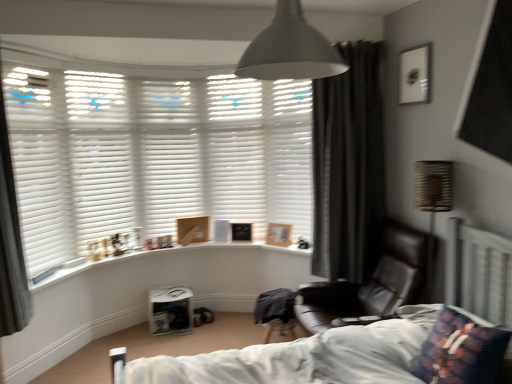
In order to face dark grey curtain at right, the second curtain in the left-to-right sequence, should I rotate leftwards or rightwards?

Turn right by 12.532 degrees to look at dark grey curtain at right, the second curtain in the left-to-right sequence.

The width and height of the screenshot is (512, 384). What do you see at coordinates (462, 350) in the screenshot?
I see `dark floral fabric pillow at lower right` at bounding box center [462, 350].

At what (x,y) coordinates should I click in order to perform the action: click on white matte shutter at upper center, which appears as the 1th shutter when viewed from the right. Please return your answer as a coordinate pair (x, y). Looking at the image, I should click on (288, 153).

Looking at this image, how much space does white matte shutter at upper center, which appears as the 2th shutter when viewed from the right, occupy horizontally?

The width of white matte shutter at upper center, which appears as the 2th shutter when viewed from the right, is 10.87 inches.

What do you see at coordinates (192, 230) in the screenshot?
I see `wooden picture frame at upper center, which is counted as the 2th picture frame, starting from the back` at bounding box center [192, 230].

This screenshot has width=512, height=384. I want to click on white wood window sill at center, so click(154, 253).

Does wooden picture frame at window, arranged as the 3th picture frame when viewed from the back, turn towards wooden picture frame at window sill, which is the 2th picture frame in left-to-right order?

No, wooden picture frame at window, arranged as the 3th picture frame when viewed from the back, is not turned towards wooden picture frame at window sill, which is the 2th picture frame in left-to-right order.

Is point (276, 229) in front of point (233, 229)?

Yes, it is.

Does wooden picture frame at window, the 2th picture frame in the front-to-back sequence, appear on the left side of wooden picture frame at window sill, marked as the 4th picture frame in a front-to-back arrangement?

No.

Considering the relative sizes of wooden picture frame at window, the 2th picture frame in the front-to-back sequence, and wooden picture frame at window sill, which is the 1th picture frame from back to front, in the image provided, is wooden picture frame at window, the 2th picture frame in the front-to-back sequence, smaller than wooden picture frame at window sill, which is the 1th picture frame from back to front,?

Incorrect, wooden picture frame at window, the 2th picture frame in the front-to-back sequence, is not smaller in size than wooden picture frame at window sill, which is the 1th picture frame from back to front.

Can you confirm if wooden picture frame at upper center, marked as the fourth picture frame in a right-to-left arrangement, is bigger than dark floral fabric pillow at lower right?

Incorrect, wooden picture frame at upper center, marked as the fourth picture frame in a right-to-left arrangement, is not larger than dark floral fabric pillow at lower right.

From the image's perspective, is wooden picture frame at upper center, the 3th picture frame in the bottom-to-top sequence, above dark floral fabric pillow at lower right?

Yes.

From the picture: Is wooden picture frame at upper center, which is the 2th picture frame from top to bottom, looking in the opposite direction of dark floral fabric pillow at lower right?

No.

From a real-world perspective, relative to dark floral fabric pillow at lower right, is wooden picture frame at upper center, the first picture frame positioned from the left, vertically above or below?

Clearly, from a real-world perspective, wooden picture frame at upper center, the first picture frame positioned from the left, is above dark floral fabric pillow at lower right.

Is matte black picture frame at upper right, which appears as the fourth picture frame when viewed from the back, positioned far away from wooden picture frame at window sill, which is the 1th picture frame from back to front?

Yes.

From the image's perspective, would you say matte black picture frame at upper right, arranged as the 1th picture frame when viewed from the top, is positioned over wooden picture frame at window sill, the third picture frame from the right?

Correct, matte black picture frame at upper right, arranged as the 1th picture frame when viewed from the top, appears higher than wooden picture frame at window sill, the third picture frame from the right, in the image.

From a real-world perspective, is matte black picture frame at upper right, which appears as the fourth picture frame when viewed from the back, physically below wooden picture frame at window sill, marked as the 4th picture frame in a front-to-back arrangement?

No, from a real-world perspective, matte black picture frame at upper right, which appears as the fourth picture frame when viewed from the back, is not below wooden picture frame at window sill, marked as the 4th picture frame in a front-to-back arrangement.

Measure the distance between matte black picture frame at upper right, arranged as the 1th picture frame when viewed from the top, and wooden picture frame at window sill, which is the 2th picture frame in left-to-right order.

matte black picture frame at upper right, arranged as the 1th picture frame when viewed from the top, is 1.90 meters away from wooden picture frame at window sill, which is the 2th picture frame in left-to-right order.

Is dark grey curtain at right, positioned as the 2th curtain in front-to-back order, in front of or behind black leather chair at lower right in the image?

Clearly, dark grey curtain at right, positioned as the 2th curtain in front-to-back order, is behind black leather chair at lower right.

Which object is positioned more to the right, dark grey curtain at right, the second curtain in the left-to-right sequence, or black leather chair at lower right?

dark grey curtain at right, the second curtain in the left-to-right sequence.

Who is smaller, dark grey curtain at right, the second curtain in the left-to-right sequence, or black leather chair at lower right?

dark grey curtain at right, the second curtain in the left-to-right sequence.

Is gray fabric curtain at left, acting as the 2th curtain starting from the right, smaller than white matte shutter at upper center, marked as the third shutter in a left-to-right arrangement?

Yes.

Is gray fabric curtain at left, which is counted as the 1th curtain, starting from the left, facing towards white matte shutter at upper center, the third shutter positioned from the right?

No, gray fabric curtain at left, which is counted as the 1th curtain, starting from the left, is not oriented towards white matte shutter at upper center, the third shutter positioned from the right.

Which is behind, gray fabric curtain at left, acting as the 2th curtain starting from the right, or white matte shutter at upper center, marked as the third shutter in a left-to-right arrangement?

white matte shutter at upper center, marked as the third shutter in a left-to-right arrangement, is behind.

Would you say gray fabric curtain at left, the first curtain when ordered from front to back, is a long distance from white matte shutter at upper center, the third shutter positioned from the right?

That's right, there is a large distance between gray fabric curtain at left, the first curtain when ordered from front to back, and white matte shutter at upper center, the third shutter positioned from the right.

Is white matte shutter at upper center, which appears as the 1th shutter when viewed from the right, aimed at white matte shutter at upper center, marked as the third shutter in a left-to-right arrangement?

No, white matte shutter at upper center, which appears as the 1th shutter when viewed from the right, is not aimed at white matte shutter at upper center, marked as the third shutter in a left-to-right arrangement.

Which object is further away from the camera taking this photo, white matte shutter at upper center, marked as the fifth shutter in a left-to-right arrangement, or white matte shutter at upper center, marked as the third shutter in a left-to-right arrangement?

white matte shutter at upper center, marked as the third shutter in a left-to-right arrangement, is further away from the camera.

Find the location of a particular element. The height and width of the screenshot is (384, 512). shutter that is the 3rd one below the white matte shutter at upper center, marked as the third shutter in a left-to-right arrangement (from a real-world perspective) is located at coordinates (288, 153).

Is white matte blinds at left, placed as the fifth shutter when sorted from right to left, aimed at black leather chair at lower right?

Yes, white matte blinds at left, placed as the fifth shutter when sorted from right to left, is facing black leather chair at lower right.

Considering the positions of objects white matte blinds at left, the 1th shutter viewed from the left, and black leather chair at lower right in the image provided, who is more to the left, white matte blinds at left, the 1th shutter viewed from the left, or black leather chair at lower right?

white matte blinds at left, the 1th shutter viewed from the left.

The width and height of the screenshot is (512, 384). Find the location of `picture frame below the wooden picture frame at window, the 2th picture frame in the right-to-left sequence (from a real-world perspective)`. picture frame below the wooden picture frame at window, the 2th picture frame in the right-to-left sequence (from a real-world perspective) is located at coordinates (241, 232).

You are a GUI agent. You are given a task and a screenshot of the screen. Output one action in this format:
    pyautogui.click(x=<x>, y=<y>)
    Task: Click on the 3rd picture frame located above the dark floral fabric pillow at lower right (from a real-world perspective)
    
    Given the screenshot: What is the action you would take?
    pyautogui.click(x=192, y=230)

Estimate the real-world distances between objects in this image. Which object is further from gray fabric curtain at left, acting as the 2th curtain starting from the right, white matte shutter at upper center, marked as the 4th shutter in a left-to-right arrangement, or wooden picture frame at upper center, which is the 2th picture frame from top to bottom?

Among the two, white matte shutter at upper center, marked as the 4th shutter in a left-to-right arrangement, is located further to gray fabric curtain at left, acting as the 2th curtain starting from the right.

Looking at the image, which one is located closer to white wood window sill at center, white matte blinds at left, placed as the fifth shutter when sorted from right to left, or dark grey curtain at right, which appears as the first curtain when viewed from the right?

white matte blinds at left, placed as the fifth shutter when sorted from right to left.

When comparing their distances from matte gray lampshade at upper center, does black leather chair at lower right or wooden picture frame at upper center, which is counted as the 2th picture frame, starting from the back, seem further?

wooden picture frame at upper center, which is counted as the 2th picture frame, starting from the back.

From the picture: Estimate the real-world distances between objects in this image. Which object is further from white matte shutter at upper center, marked as the fifth shutter in a left-to-right arrangement, matte black picture frame at upper right, positioned as the 1th picture frame in front-to-back order, or wooden picture frame at upper center, which is counted as the 2th picture frame, starting from the back?

matte black picture frame at upper right, positioned as the 1th picture frame in front-to-back order, is positioned further to the anchor white matte shutter at upper center, marked as the fifth shutter in a left-to-right arrangement.

Looking at the image, which one is located further to wooden picture frame at upper center, which is counted as the 2th picture frame, starting from the back, white matte shutter at upper center, which appears as the 1th shutter when viewed from the right, or matte gray lampshade at upper center?

Based on the image, matte gray lampshade at upper center appears to be further to wooden picture frame at upper center, which is counted as the 2th picture frame, starting from the back.

Based on their spatial positions, is matte black picture frame at upper right, acting as the 4th picture frame starting from the left, or white matte blinds at left, the 1th shutter viewed from the left, closer to wooden picture frame at window sill, which is counted as the 3th picture frame, starting from the top?

white matte blinds at left, the 1th shutter viewed from the left.

When comparing their distances from white matte shutter at upper center, which appears as the 1th shutter when viewed from the right, does wooden picture frame at window sill, marked as the 4th picture frame in a front-to-back arrangement, or white matte shutter at upper center, which appears as the 2th shutter when viewed from the right, seem further?

Based on the image, wooden picture frame at window sill, marked as the 4th picture frame in a front-to-back arrangement, appears to be further to white matte shutter at upper center, which appears as the 1th shutter when viewed from the right.

Considering their positions, is white wood window sill at center positioned closer to wooden picture frame at window, the 2th picture frame in the right-to-left sequence, than woven fabric table lamp at right?

white wood window sill at center lies closer to wooden picture frame at window, the 2th picture frame in the right-to-left sequence, than the other object.

Image resolution: width=512 pixels, height=384 pixels. I want to click on chair between dark floral fabric pillow at lower right and white matte shutter at upper center, which appears as the 1th shutter when viewed from the right, in the front-back direction, so click(x=371, y=284).

Locate an element on the screen. chair between white wood window sill at center and dark floral fabric pillow at lower right from left to right is located at coordinates (371, 284).

Locate an element on the screen. The image size is (512, 384). pillow between white matte blinds at upper left, which ranks as the 4th shutter in right-to-left order, and woven fabric table lamp at right is located at coordinates (462, 350).

The image size is (512, 384). Find the location of `curtain located between black leather chair at lower right and white matte shutter at upper center, marked as the 4th shutter in a left-to-right arrangement, in the depth direction`. curtain located between black leather chair at lower right and white matte shutter at upper center, marked as the 4th shutter in a left-to-right arrangement, in the depth direction is located at coordinates (348, 166).